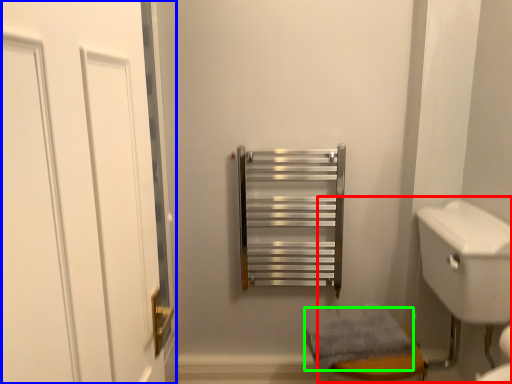
Question: Which object is positioned farthest from sink (highlighted by a red box)? Select from door (highlighted by a blue box) and bath towel (highlighted by a green box).

Choices:
 (A) door
 (B) bath towel

Answer: (A)